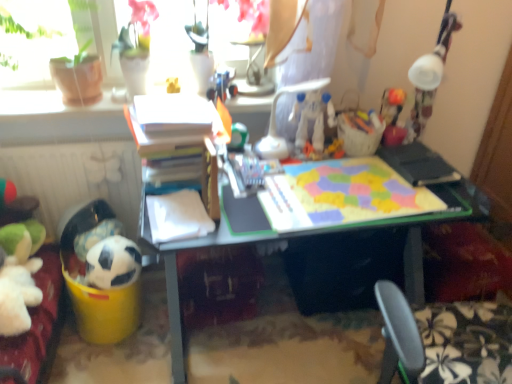
Question: Is the position of white plastic robot at center, which ranks as the third toy in bottom-to-top order, less distant than that of white matte soccer ball at lower left?

Choices:
 (A) yes
 (B) no

Answer: (B)

Question: Is white plastic robot at center, acting as the fourth toy starting from the left, not close to white matte soccer ball at lower left?

Choices:
 (A) no
 (B) yes

Answer: (A)

Question: Does white plastic robot at center, positioned as the 1th toy in right-to-left order, have a lesser width compared to white matte soccer ball at lower left?

Choices:
 (A) no
 (B) yes

Answer: (B)

Question: Would you say white plastic robot at center, marked as the second toy in a top-to-bottom arrangement, contains white matte soccer ball at lower left?

Choices:
 (A) yes
 (B) no

Answer: (B)

Question: Is white plastic robot at center, positioned as the 1th toy in right-to-left order, beside white matte soccer ball at lower left?

Choices:
 (A) no
 (B) yes

Answer: (A)

Question: From a real-world perspective, is white plastic robot at center, marked as the second toy in a top-to-bottom arrangement, physically below white matte soccer ball at lower left?

Choices:
 (A) yes
 (B) no

Answer: (B)

Question: Is white plastic robot at center, which ranks as the third toy in bottom-to-top order, outside of green matte ball at center, positioned as the 3th toy in top-to-bottom order?

Choices:
 (A) no
 (B) yes

Answer: (B)

Question: From a real-world perspective, is white plastic robot at center, acting as the fourth toy starting from the left, positioned over green matte ball at center, which ranks as the 2th toy in bottom-to-top order, based on gravity?

Choices:
 (A) no
 (B) yes

Answer: (B)

Question: Is white plastic robot at center, positioned as the 1th toy in right-to-left order, oriented towards green matte ball at center, the third toy from the left?

Choices:
 (A) no
 (B) yes

Answer: (A)

Question: Does white plastic robot at center, positioned as the 1th toy in right-to-left order, have a greater height compared to green matte ball at center, which ranks as the 2th toy in bottom-to-top order?

Choices:
 (A) no
 (B) yes

Answer: (B)

Question: From a real-world perspective, is white plastic robot at center, marked as the second toy in a top-to-bottom arrangement, under green matte ball at center, positioned as the 3th toy in top-to-bottom order?

Choices:
 (A) no
 (B) yes

Answer: (A)

Question: Does white plastic robot at center, marked as the second toy in a top-to-bottom arrangement, have a lesser width compared to green matte ball at center, the third toy from the left?

Choices:
 (A) no
 (B) yes

Answer: (A)

Question: Can you confirm if white plastic chair at center is positioned to the left of matte plastic desk at center?

Choices:
 (A) no
 (B) yes

Answer: (B)